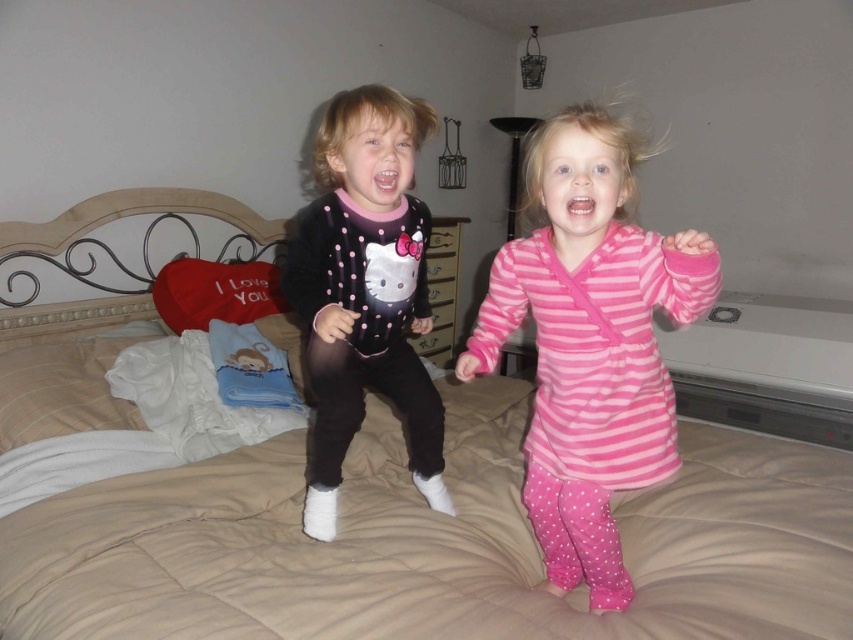
You are a parent entering the bedroom and notice the beige quilted bed at center and the matte black hello kitty onesie at center. Which item is positioned higher up in the scene?

The matte black hello kitty onesie at center is positioned higher up in the scene than the beige quilted bed at center.

You are a parent trying to decide whether to place the pink striped dress at center on the beige quilted bed at center. Considering the size of the bed and the dress, will the dress fit comfortably without hanging off the edge?

The beige quilted bed at center is wider than the pink striped dress at center, so placing the pink striped dress at center on the bed will allow it to fit comfortably without hanging off the edge.

You are a parent trying to ensure the safety of your children while they play. You notice the beige quilted bed at center and the matte black hello kitty onesie at center. Which object is closer to you, and why might this matter for their safety?

The beige quilted bed at center is closer to the viewer than the matte black hello kitty onesie at center. This matters because the child wearing the matte black hello kitty onesie at center is farther away, making it harder to monitor their movements, potentially increasing the risk of them falling off the bed.